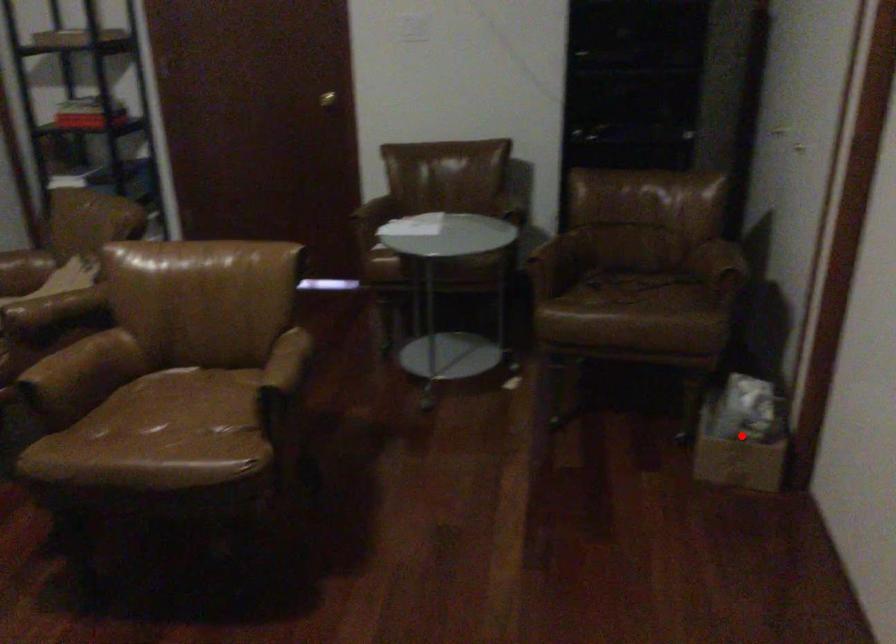
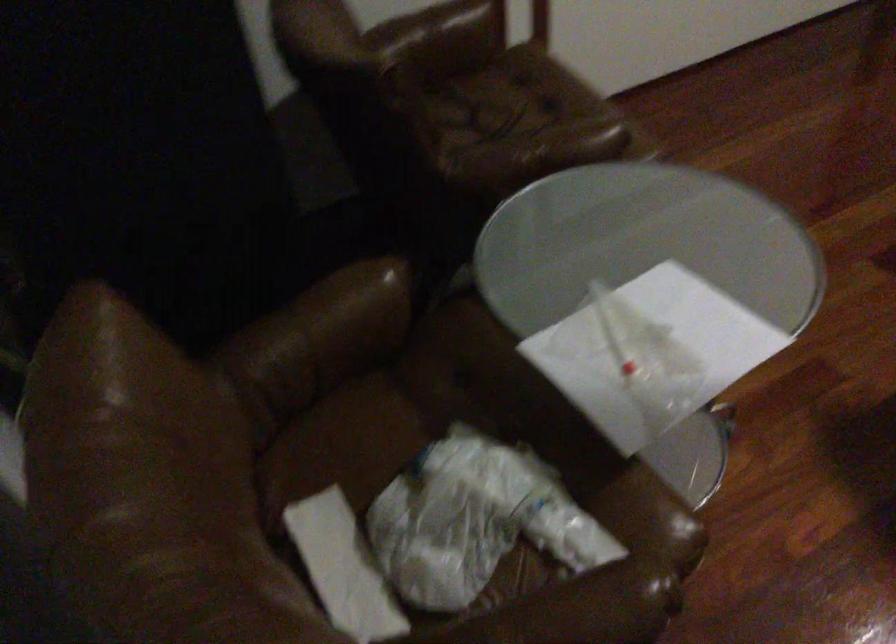
Question: I am providing you with two images of the same scene from different viewpoints. A red point is marked on the first image. At the location where the point appears in image 1, is it still visible in image 2?

Choices:
 (A) Yes
 (B) No

Answer: (B)